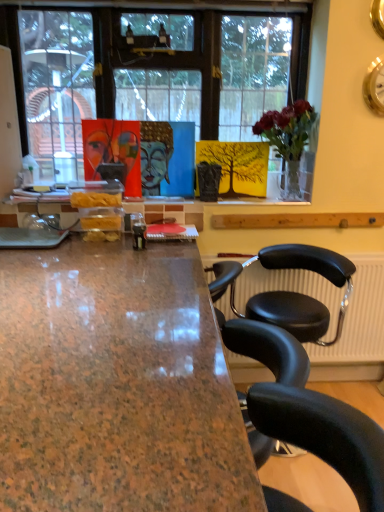
Question: Is blue glossy buddha head at center positioned in front of matte acrylic painting of a human face at upper center?

Choices:
 (A) no
 (B) yes

Answer: (A)

Question: From the image's perspective, would you say blue glossy buddha head at center is positioned over matte acrylic painting of a human face at upper center?

Choices:
 (A) yes
 (B) no

Answer: (A)

Question: Can you confirm if blue glossy buddha head at center is wider than matte acrylic painting of a human face at upper center?

Choices:
 (A) yes
 (B) no

Answer: (A)

Question: From a real-world perspective, is blue glossy buddha head at center under matte acrylic painting of a human face at upper center?

Choices:
 (A) no
 (B) yes

Answer: (B)

Question: Does blue glossy buddha head at center appear on the left side of matte acrylic painting of a human face at upper center?

Choices:
 (A) yes
 (B) no

Answer: (B)

Question: Is brown polished granite desk at center spatially inside matte acrylic painting of a human face at upper center, or outside of it?

Choices:
 (A) outside
 (B) inside

Answer: (A)

Question: In terms of height, does brown polished granite desk at center look taller or shorter compared to matte acrylic painting of a human face at upper center?

Choices:
 (A) short
 (B) tall

Answer: (B)

Question: Is brown polished granite desk at center to the left or to the right of matte acrylic painting of a human face at upper center in the image?

Choices:
 (A) left
 (B) right

Answer: (B)

Question: From the image's perspective, is brown polished granite desk at center located above or below matte acrylic painting of a human face at upper center?

Choices:
 (A) above
 (B) below

Answer: (B)

Question: Is black leather chair at right in front of or behind matte acrylic painting of a human face at upper center in the image?

Choices:
 (A) front
 (B) behind

Answer: (A)

Question: Is black leather chair at right spatially inside matte acrylic painting of a human face at upper center, or outside of it?

Choices:
 (A) inside
 (B) outside

Answer: (B)

Question: From the image's perspective, relative to matte acrylic painting of a human face at upper center, is black leather chair at right above or below?

Choices:
 (A) above
 (B) below

Answer: (B)

Question: Considering the positions of point (297, 260) and point (129, 140), is point (297, 260) closer or farther from the camera than point (129, 140)?

Choices:
 (A) farther
 (B) closer

Answer: (B)

Question: From a real-world perspective, is brown polished granite desk at center above or below blue glossy buddha head at center?

Choices:
 (A) below
 (B) above

Answer: (A)

Question: Is point click(183, 263) positioned closer to the camera than point click(160, 138)?

Choices:
 (A) closer
 (B) farther

Answer: (A)